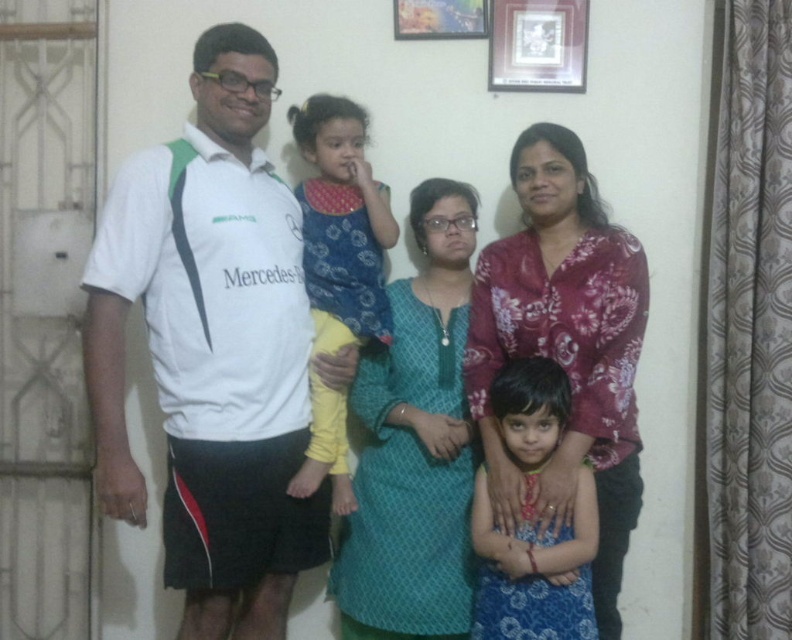
You are a photographer setting up for a family photo. You notice the white jersey at left and the metallic silver picture frame at upper center. Which object is bigger in size?

The white jersey at left is larger in size compared to the metallic silver picture frame at upper center.

From the picture: You are standing at point (124, 531) and want to reach the front door, which is located 3 meters away from your current position. Can you safely walk straight to the door without any obstacles?

Yes, you can safely walk straight to the door because there are no obstacles mentioned in the scene description between your current position at point (124, 531) and the door 3 meters away. The scene only mentions the family members and the wall with pictures, but their positions do not block the path.

You are a photographer setting up for a family photo. You need to ensure that the white jersey at left and the metallic silver picture frame at upper center are both visible in the shot. Which object should you prioritize keeping in the frame if you have to choose one due to limited space?

You should prioritize keeping the white jersey at left in the frame because its width is larger than the metallic silver picture frame at upper center, making it more prominent and likely more important to capture in the photo.